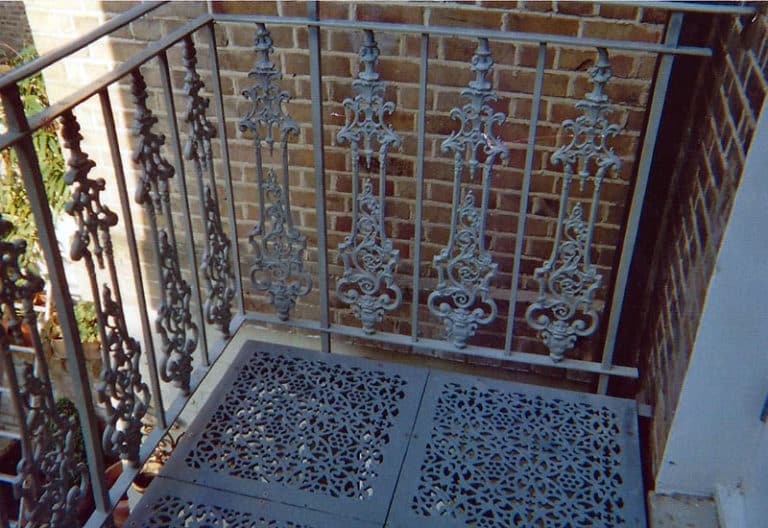
What are the coordinates of `ladder` in the screenshot? It's located at (11, 426).